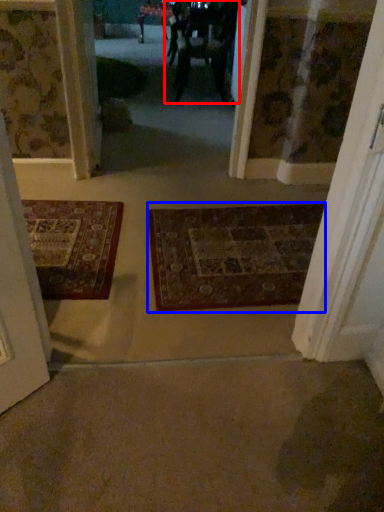
Question: Which object is closer to the camera taking this photo, couple (highlighted by a red box) or mat (highlighted by a blue box)?

Choices:
 (A) couple
 (B) mat

Answer: (B)